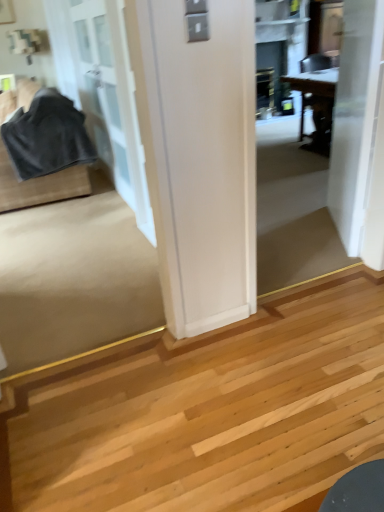
Question: Can you confirm if velvet-like black fabric at left is smaller than white smooth door at upper right, which ranks as the first door in right-to-left order?

Choices:
 (A) no
 (B) yes

Answer: (A)

Question: From a real-world perspective, is velvet-like black fabric at left over white smooth door at upper right, which ranks as the first door in right-to-left order?

Choices:
 (A) no
 (B) yes

Answer: (A)

Question: Considering the relative positions of velvet-like black fabric at left and white smooth door at upper right, which ranks as the first door in right-to-left order, in the image provided, is velvet-like black fabric at left to the left of white smooth door at upper right, which ranks as the first door in right-to-left order, from the viewer's perspective?

Choices:
 (A) yes
 (B) no

Answer: (A)

Question: Can you confirm if velvet-like black fabric at left is positioned to the right of white smooth door at upper right, which ranks as the first door in right-to-left order?

Choices:
 (A) no
 (B) yes

Answer: (A)

Question: Is velvet-like black fabric at left positioned before white smooth door at upper right, which ranks as the first door in right-to-left order?

Choices:
 (A) yes
 (B) no

Answer: (B)

Question: Is velvet-like black fabric at left turned away from white smooth door at upper right, which ranks as the second door in left-to-right order?

Choices:
 (A) yes
 (B) no

Answer: (B)

Question: From a real-world perspective, is white smooth door at upper right, which ranks as the second door in left-to-right order, positioned under white glass door at left, arranged as the 1th door when viewed from the left, based on gravity?

Choices:
 (A) no
 (B) yes

Answer: (B)

Question: Is white smooth door at upper right, which ranks as the second door in left-to-right order, shorter than white glass door at left, arranged as the 1th door when viewed from the left?

Choices:
 (A) no
 (B) yes

Answer: (B)

Question: Can you confirm if white smooth door at upper right, which ranks as the first door in right-to-left order, is wider than white glass door at left, the 2th door when ordered from right to left?

Choices:
 (A) no
 (B) yes

Answer: (A)

Question: From the image's perspective, is white smooth door at upper right, which ranks as the second door in left-to-right order, beneath white glass door at left, arranged as the 1th door when viewed from the left?

Choices:
 (A) yes
 (B) no

Answer: (A)

Question: Is white smooth door at upper right, which ranks as the first door in right-to-left order, taller than white glass door at left, arranged as the 1th door when viewed from the left?

Choices:
 (A) yes
 (B) no

Answer: (B)

Question: Does white smooth door at upper right, which ranks as the second door in left-to-right order, have a smaller size compared to white glass door at left, the 2th door when ordered from right to left?

Choices:
 (A) no
 (B) yes

Answer: (B)

Question: Is white glass door at left, the 2th door when ordered from right to left, oriented away from velvet-like black fabric at left?

Choices:
 (A) no
 (B) yes

Answer: (B)